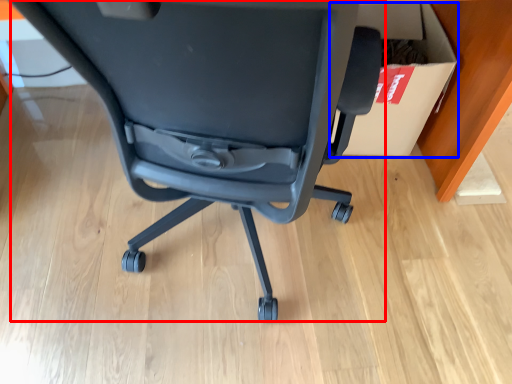
Question: Which of the following is the farthest to the observer, chair (highlighted by a red box) or cardboard box (highlighted by a blue box)?

Choices:
 (A) chair
 (B) cardboard box

Answer: (B)